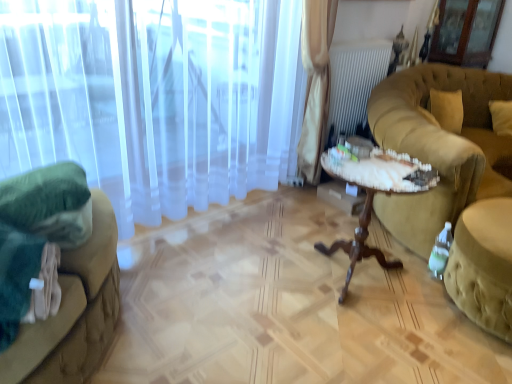
Question: Is woodenwoodentable at right wider than white sheer curtain at left?

Choices:
 (A) no
 (B) yes

Answer: (B)

Question: Considering the relative sizes of woodenwoodentable at right and white sheer curtain at left in the image provided, is woodenwoodentable at right bigger than white sheer curtain at left?

Choices:
 (A) no
 (B) yes

Answer: (A)

Question: Is the depth of woodenwoodentable at right less than that of white sheer curtain at left?

Choices:
 (A) no
 (B) yes

Answer: (A)

Question: Is woodenwoodentable at right at the right side of white sheer curtain at left?

Choices:
 (A) no
 (B) yes

Answer: (B)

Question: Is woodenwoodentable at right to the left of white sheer curtain at left from the viewer's perspective?

Choices:
 (A) no
 (B) yes

Answer: (A)

Question: Is white sheer curtain at left inside woodenwoodentable at right?

Choices:
 (A) no
 (B) yes

Answer: (A)

Question: Is green fabric studio couch at left, acting as the 2th studio couch starting from the right, bigger than woodenwoodentable at right?

Choices:
 (A) no
 (B) yes

Answer: (B)

Question: From a real-world perspective, is green fabric studio couch at left, acting as the 2th studio couch starting from the right, over woodenwoodentable at right?

Choices:
 (A) no
 (B) yes

Answer: (A)

Question: Is green fabric studio couch at left, positioned as the first studio couch in left-to-right order, to the left of woodenwoodentable at right from the viewer's perspective?

Choices:
 (A) yes
 (B) no

Answer: (A)

Question: Is woodenwoodentable at right inside green fabric studio couch at left, acting as the 2th studio couch starting from the right?

Choices:
 (A) yes
 (B) no

Answer: (B)

Question: Is the depth of green fabric studio couch at left, positioned as the first studio couch in left-to-right order, less than that of woodenwoodentable at right?

Choices:
 (A) yes
 (B) no

Answer: (A)

Question: Does green fabric studio couch at left, acting as the 2th studio couch starting from the right, have a greater height compared to woodenwoodentable at right?

Choices:
 (A) no
 (B) yes

Answer: (A)

Question: Considering the relative positions of transparent glass screen door at upper right and white sheer curtain at left in the image provided, is transparent glass screen door at upper right to the right of white sheer curtain at left from the viewer's perspective?

Choices:
 (A) yes
 (B) no

Answer: (A)